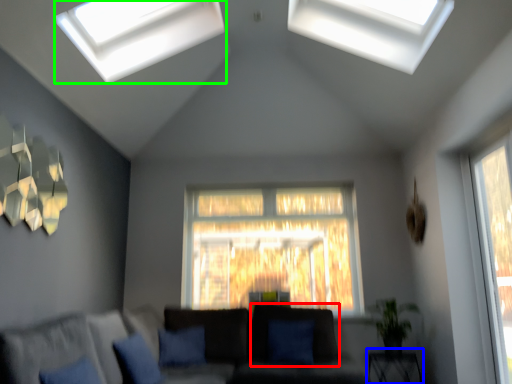
Question: Which object is positioned farthest from sit (highlighted by a red box)? Select from table (highlighted by a blue box) and window (highlighted by a green box).

Choices:
 (A) table
 (B) window

Answer: (B)